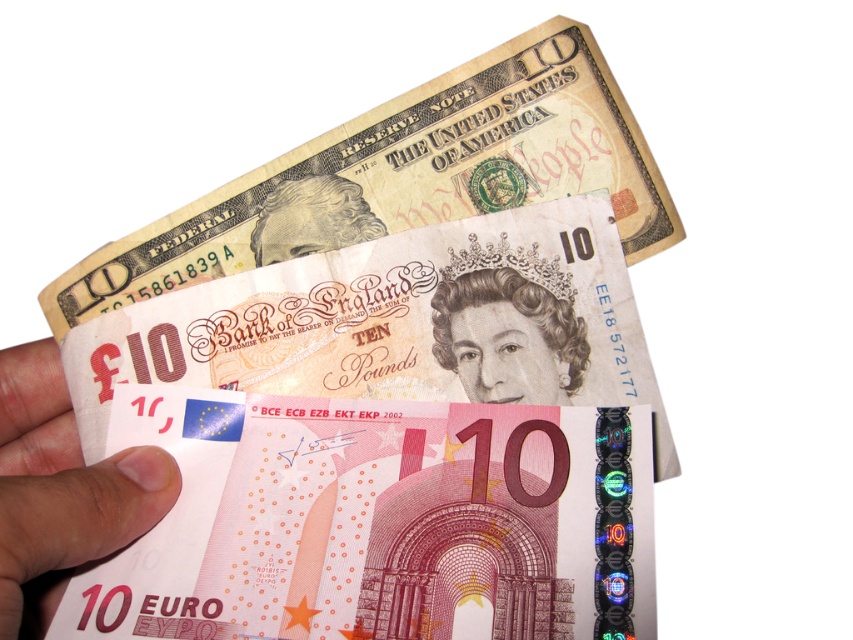
Between white matte paper at lower left and smooth beige portrait at upper center, which one appears on the right side from the viewer's perspective?

smooth beige portrait at upper center

Is white matte paper at lower left above smooth beige portrait at upper center?

No, white matte paper at lower left is not above smooth beige portrait at upper center.

Identify the location of white matte paper at lower left. (61, 490).

I want to click on white matte paper at lower left, so click(x=61, y=490).

Which is in front, point (3, 604) or point (532, 307)?

Positioned in front is point (3, 604).

Describe the element at coordinates (61, 490) in the screenshot. I see `white matte paper at lower left` at that location.

At what (x,y) coordinates should I click in order to perform the action: click on white matte paper at lower left. Please return your answer as a coordinate pair (x, y). This screenshot has width=853, height=640. Looking at the image, I should click on (61, 490).

Is point (451, 136) farther from viewer compared to point (132, 481)?

Yes, point (451, 136) is behind point (132, 481).

Who is more distant from viewer, (152, 284) or (55, 483)?

The point (152, 284) is behind.

Which is in front, point (373, 122) or point (9, 609)?

Positioned in front is point (9, 609).

The image size is (853, 640). What are the coordinates of `pink paper currency at center` in the screenshot? It's located at (416, 170).